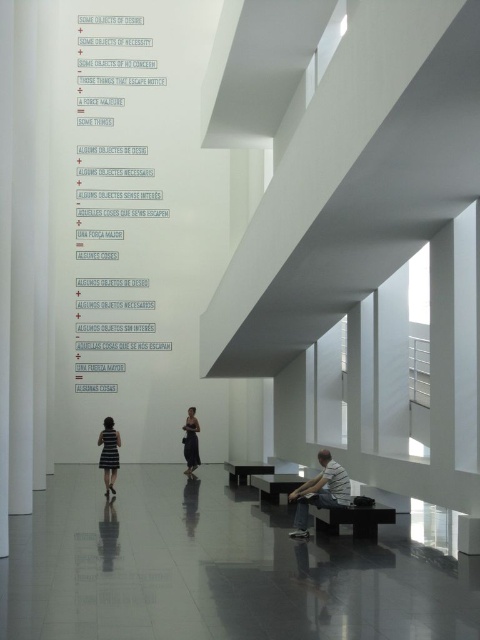
Who is taller, black polished wood bench at lower right or matte black bench at lower center?

Standing taller between the two is black polished wood bench at lower right.

Can you confirm if black polished wood bench at lower right is positioned above matte black bench at lower center?

Yes, black polished wood bench at lower right is above matte black bench at lower center.

The height and width of the screenshot is (640, 480). What do you see at coordinates (351, 518) in the screenshot?
I see `black polished wood bench at lower right` at bounding box center [351, 518].

Identify the location of black polished wood bench at lower right. This screenshot has width=480, height=640. (351, 518).

Who is lower down, black polished wood bench at lower right or matte black bench at center?

matte black bench at center

Can you confirm if black polished wood bench at lower right is bigger than matte black bench at center?

Indeed, black polished wood bench at lower right has a larger size compared to matte black bench at center.

Locate an element on the screen. This screenshot has width=480, height=640. black polished wood bench at lower right is located at coordinates (351, 518).

The image size is (480, 640). I want to click on black polished wood bench at lower right, so click(x=351, y=518).

Is point (196, 442) closer to camera compared to point (254, 465)?

No, it is not.

Does black silk dress at center appear on the right side of matte black bench at center?

Incorrect, black silk dress at center is not on the right side of matte black bench at center.

Between point (190, 428) and point (273, 465), which one is positioned behind?

Positioned behind is point (190, 428).

The height and width of the screenshot is (640, 480). I want to click on black silk dress at center, so click(191, 442).